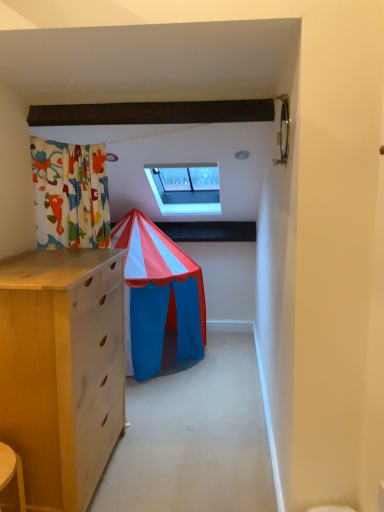
The height and width of the screenshot is (512, 384). Describe the element at coordinates (185, 188) in the screenshot. I see `transparent glass window at upper center` at that location.

Image resolution: width=384 pixels, height=512 pixels. Find the location of `transparent glass window at upper center`. transparent glass window at upper center is located at coordinates (185, 188).

In order to click on transparent glass window at upper center in this screenshot , I will do `click(185, 188)`.